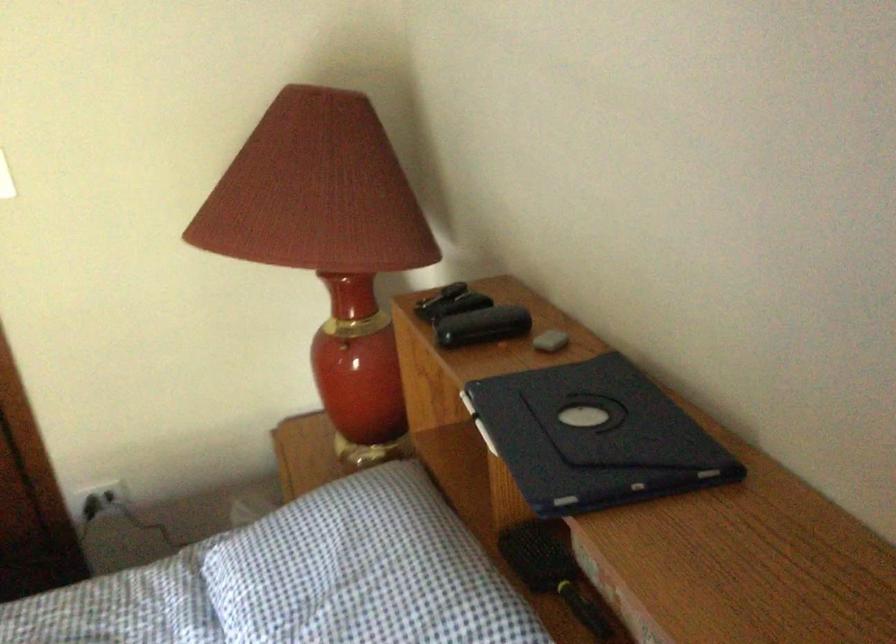
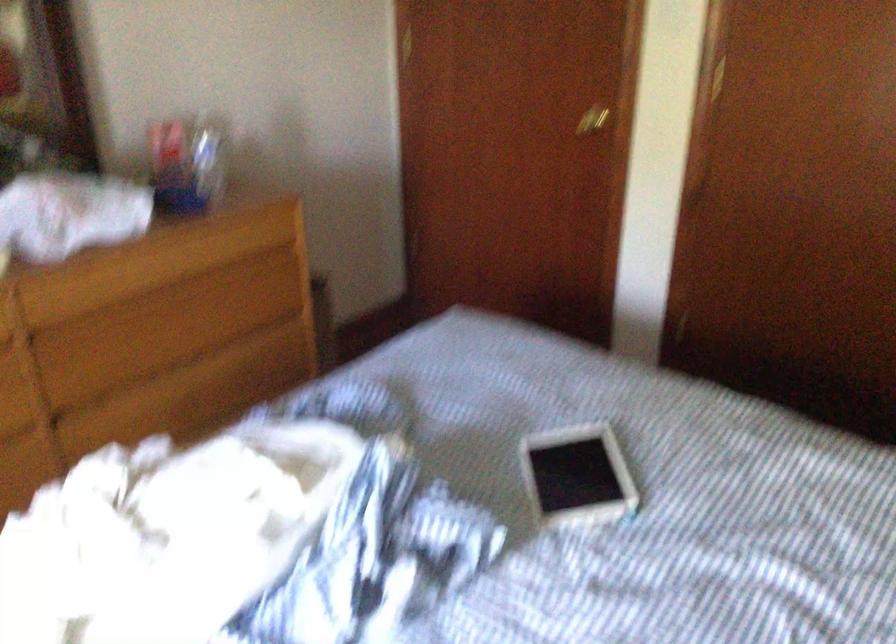
How did the camera likely rotate?

The camera rotated toward left-down.